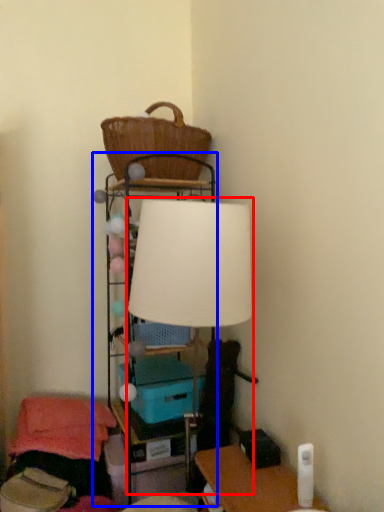
Question: Which object appears farthest to the camera in this image, lamp (highlighted by a red box) or shelf (highlighted by a blue box)?

Choices:
 (A) lamp
 (B) shelf

Answer: (B)